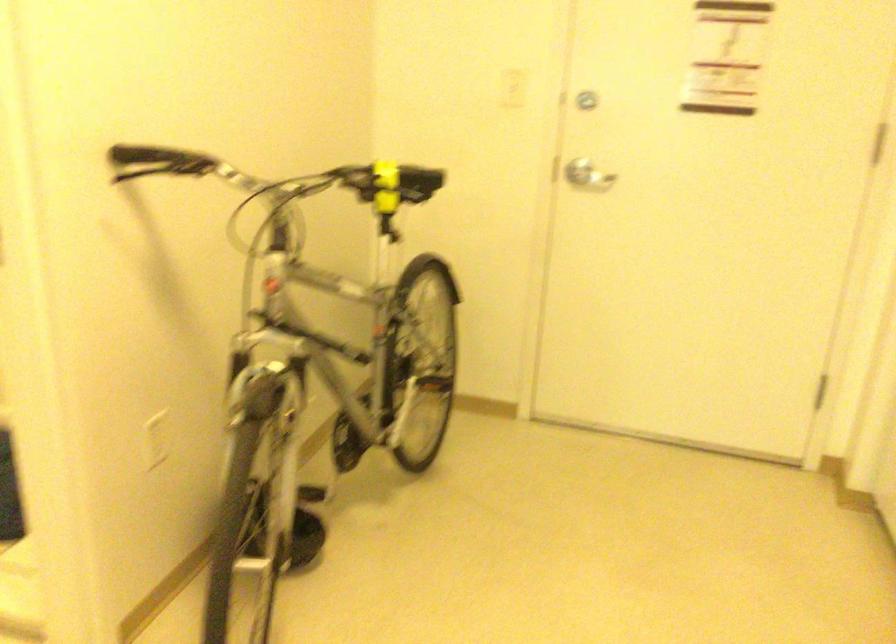
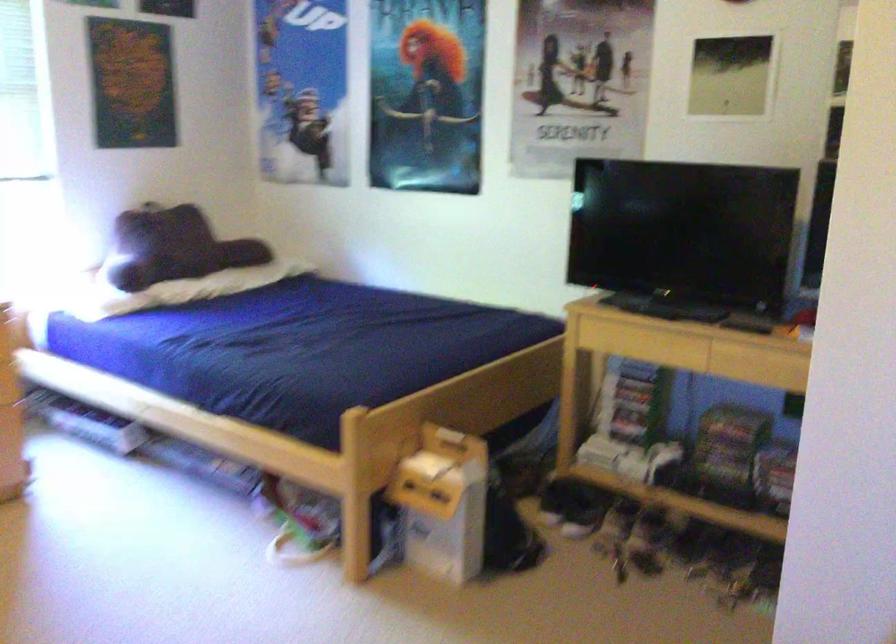
Based on the continuous images, in which direction is the camera rotating?

The camera rotated toward left-down.